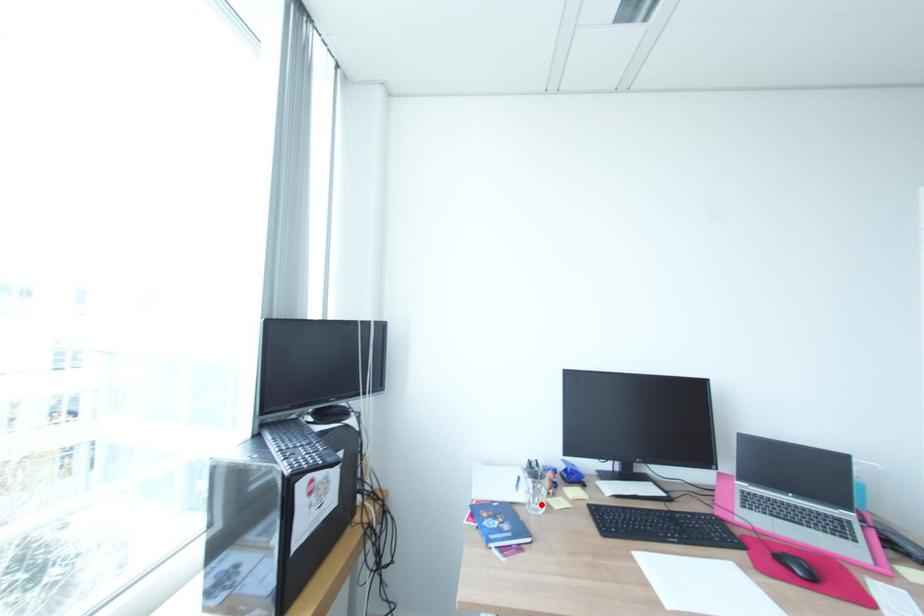
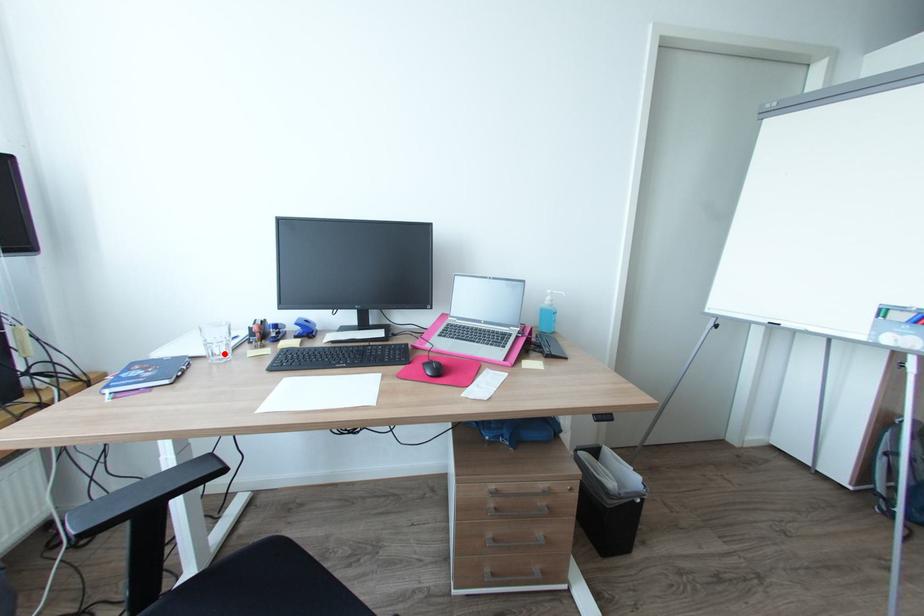
I am providing you with two images of the same scene from different viewpoints. A red point is marked on the first image and another point is marked on the second image. Does the point marked in image1 correspond to the same location as the one in image2?

Yes